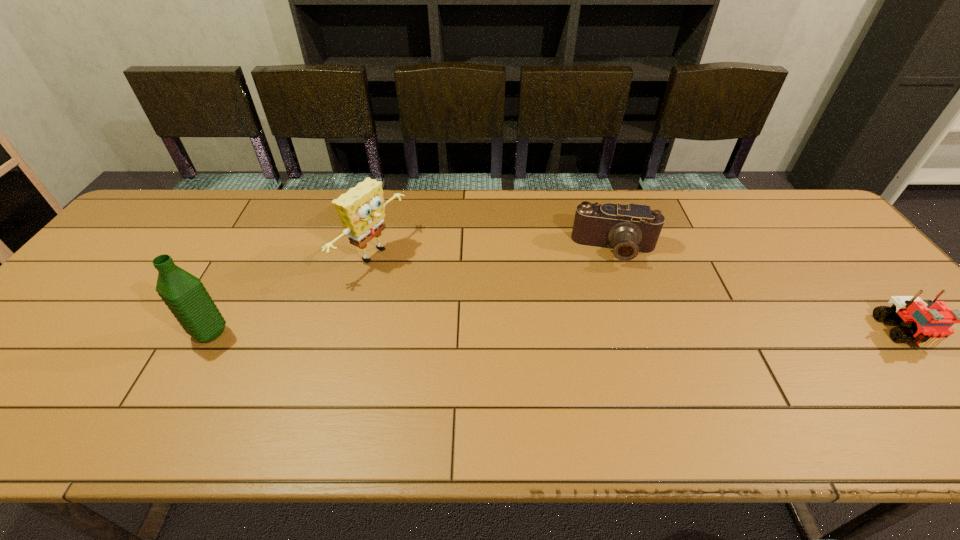
Locate an element on the screen. The width and height of the screenshot is (960, 540). object that stands as the second closest to the leftmost object is located at coordinates (628, 229).

Identify the location of vacant space that satisfies the following two spatial constraints: 1. on the back side of the camera; 2. on the left side of the water bottle. This screenshot has height=540, width=960. (256, 249).

The width and height of the screenshot is (960, 540). I want to click on free space that satisfies the following two spatial constraints: 1. on the back side of the third object from left to right; 2. on the right side of the leftmost object, so click(x=256, y=249).